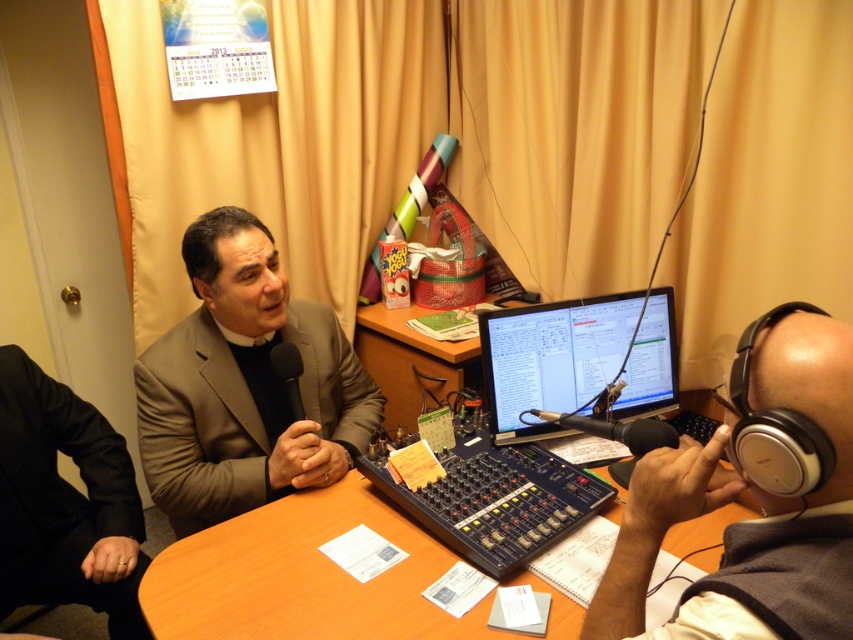
You are setting up a camera to film the broadcast in the radio studio. The camera is positioned to capture both the white matte headphones at upper right and the black fabric business suit at lower left. Which object should you adjust the camera angle to focus on first if you want to prioritize the taller object?

The black fabric business suit at lower left is taller than the white matte headphones at upper right, so you should adjust the camera angle to focus on the black fabric business suit at lower left first.

Consider the image. You are a guest entering the radio studio and want to sit down at the wooden round table at center. To your left, there is a matte brown suit at center. Which direction should you move to reach the table?

The matte brown suit at center is to the left of the wooden round table at center, so you should move to your right to reach the table.

You are a guest entering the radio studio and need to sit at the wooden round table at center. However, the host is currently wearing the matte brown suit at center. Can you walk around the host to reach the table?

The wooden round table at center is behind the matte brown suit at center, so yes, you can walk around the host wearing the matte brown suit at center to reach the wooden round table at center.